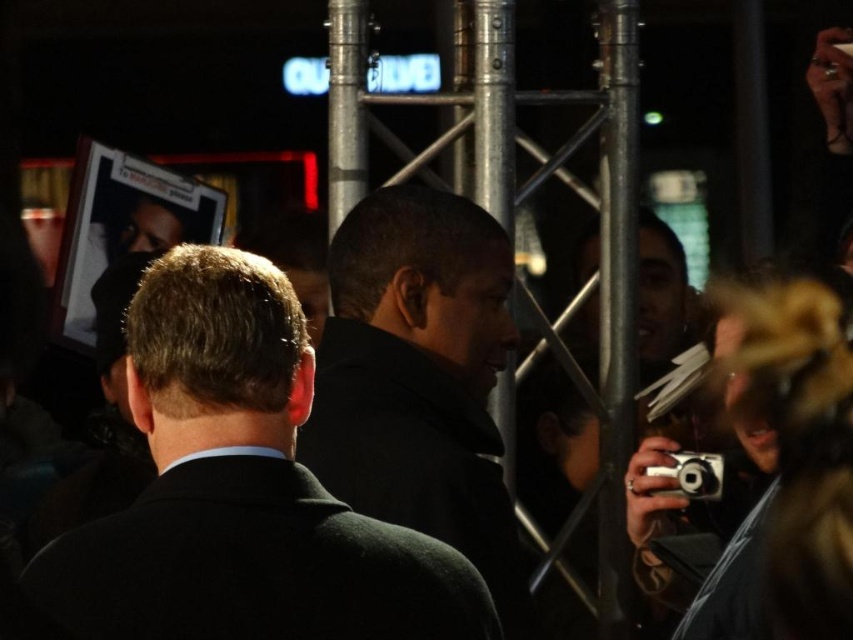
Question: Is black woolen suit at center bigger than silver metallic camera at lower right?

Choices:
 (A) no
 (B) yes

Answer: (B)

Question: Does black woolen suit at center have a larger size compared to silver metallic camera at lower right?

Choices:
 (A) yes
 (B) no

Answer: (A)

Question: Which object is positioned closest to the dark gray wool coat at center?

Choices:
 (A) silver metallic camera at lower right
 (B) black wool coat at center
 (C) black woolen suit at center

Answer: (B)

Question: Which point is farther from the camera taking this photo?

Choices:
 (A) (718, 497)
 (B) (154, 552)

Answer: (A)

Question: Is black wool coat at center positioned before black woolen suit at center?

Choices:
 (A) yes
 (B) no

Answer: (B)

Question: Which of the following is the farthest from the observer?

Choices:
 (A) black woolen suit at center
 (B) black wool coat at center
 (C) dark gray wool coat at center

Answer: (C)